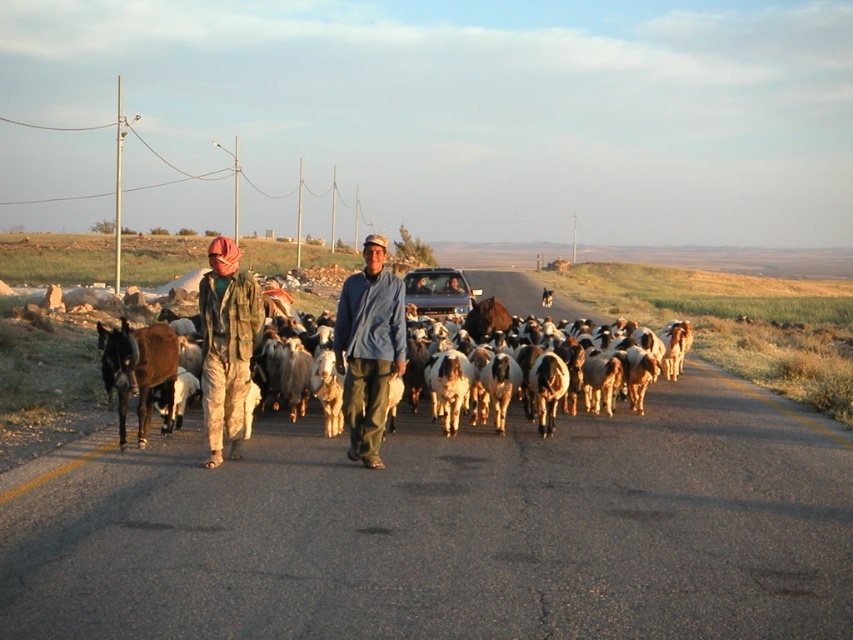
Question: Is blue denim shirt at center thinner than metallic silver truck at center?

Choices:
 (A) yes
 (B) no

Answer: (A)

Question: Which point is closer to the camera?

Choices:
 (A) (453, 278)
 (B) (148, 326)
 (C) (213, 392)

Answer: (C)

Question: Which object appears farthest from the camera in this image?

Choices:
 (A) white woolen goats at center
 (B) camouflage fabric at left
 (C) blue denim shirt at center

Answer: (A)

Question: Which point is closer to the camera?

Choices:
 (A) white woolen goats at center
 (B) camouflage fabric at left
 (C) metallic silver truck at center
 (D) blue denim shirt at center

Answer: (D)

Question: Is blue denim shirt at center wider than white woolen goats at center?

Choices:
 (A) yes
 (B) no

Answer: (B)

Question: Is blue denim shirt at center below camouflage fabric at left?

Choices:
 (A) no
 (B) yes

Answer: (A)